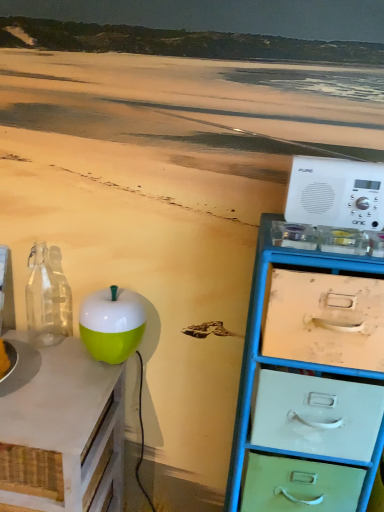
The height and width of the screenshot is (512, 384). What do you see at coordinates (310, 373) in the screenshot? I see `metallic blue chest of drawers at right` at bounding box center [310, 373].

This screenshot has height=512, width=384. What do you see at coordinates (42, 300) in the screenshot?
I see `transparent glass bottle at left` at bounding box center [42, 300].

In order to click on transparent glass bottle at left in this screenshot , I will do `click(42, 300)`.

Image resolution: width=384 pixels, height=512 pixels. Find the location of `metallic blue chest of drawers at right`. metallic blue chest of drawers at right is located at coordinates (310, 373).

Is green glossy apple at center-left taller than transparent glass bottle at left?

Incorrect, the height of green glossy apple at center-left is not larger of that of transparent glass bottle at left.

At what (x,y) coordinates should I click in order to perform the action: click on bottle that is behind the green glossy apple at center-left. Please return your answer as a coordinate pair (x, y). Image resolution: width=384 pixels, height=512 pixels. Looking at the image, I should click on (42, 300).

Is point (88, 322) closer or farther from the camera than point (36, 266)?

Point (88, 322).

Could you tell me if green glossy apple at center-left is facing transparent glass bottle at left?

No, green glossy apple at center-left is not turned towards transparent glass bottle at left.

Who is taller, green glossy apple at center-left or white plastic radio at right?

Standing taller between the two is green glossy apple at center-left.

Does green glossy apple at center-left have a smaller size compared to white plastic radio at right?

No.

From a real-world perspective, which is physically below, green glossy apple at center-left or white plastic radio at right?

In real-world perspective, green glossy apple at center-left is lower.

Between transparent glass bottle at left and metallic blue chest of drawers at right, which one has less height?

transparent glass bottle at left.

Between point (34, 319) and point (331, 442), which one is positioned behind?

The point (34, 319) is behind.

Which is correct: transparent glass bottle at left is inside metallic blue chest of drawers at right, or outside of it?

transparent glass bottle at left is spatially situated outside metallic blue chest of drawers at right.

Would you say transparent glass bottle at left is to the left or to the right of metallic blue chest of drawers at right in the picture?

transparent glass bottle at left is positioned on metallic blue chest of drawers at right's left side.

At what (x,y) coordinates should I click in order to perform the action: click on table that is under the white plastic radio at right (from a real-world perspective). Please return your answer as a coordinate pair (x, y). This screenshot has height=512, width=384. Looking at the image, I should click on (61, 430).

Considering the positions of points (346, 192) and (32, 441), is point (346, 192) farther from camera compared to point (32, 441)?

Yes, it is.

From a real-world perspective, is white plastic radio at right below green matte apple at left?

No, from a real-world perspective, white plastic radio at right is not beneath green matte apple at left.

From a real-world perspective, between green matte apple at left and white plastic radio at right, who is vertically higher?

From a 3D spatial view, white plastic radio at right is above.

Which point is more forward, (30, 496) or (310, 158)?

The point (310, 158) is closer.

Locate an element on the screen. The height and width of the screenshot is (512, 384). table that is under the white plastic radio at right (from a real-world perspective) is located at coordinates 61,430.

From the image's perspective, is transparent glass bottle at left beneath green matte apple at left?

No, from the image's perspective, transparent glass bottle at left is not beneath green matte apple at left.

From their relative heights in the image, would you say transparent glass bottle at left is taller or shorter than green matte apple at left?

Considering their sizes, transparent glass bottle at left has less height than green matte apple at left.

Is transparent glass bottle at left facing away from green matte apple at left?

No, green matte apple at left is not at the back of transparent glass bottle at left.

Is point (29, 451) closer to viewer compared to point (120, 291)?

Yes, it is.

Considering the relative positions of green matte apple at left and green glossy apple at center-left in the image provided, is green matte apple at left behind green glossy apple at center-left?

No, it is in front of green glossy apple at center-left.

Which object is positioned more to the left, green matte apple at left or green glossy apple at center-left?

Positioned to the left is green matte apple at left.

What are the coordinates of `bottle on the left of green glossy apple at center-left` in the screenshot? It's located at (42, 300).

This screenshot has width=384, height=512. I want to click on appliance in front of the green glossy apple at center-left, so click(x=336, y=193).

When comparing their distances from green matte apple at left, does green glossy apple at center-left or white plastic radio at right seem closer?

green glossy apple at center-left lies closer to green matte apple at left than the other object.

Considering their positions, is green glossy apple at center-left positioned further to metallic blue chest of drawers at right than green matte apple at left?

Based on the image, green matte apple at left appears to be further to metallic blue chest of drawers at right.

Which object lies further to the anchor point white plastic radio at right, metallic blue chest of drawers at right or green glossy apple at center-left?

Based on the image, green glossy apple at center-left appears to be further to white plastic radio at right.

From the image, which object appears to be nearer to metallic blue chest of drawers at right, green matte apple at left or green glossy apple at center-left?

green glossy apple at center-left is closer to metallic blue chest of drawers at right.

From the image, which object appears to be nearer to green glossy apple at center-left, metallic blue chest of drawers at right or white plastic radio at right?

The object closer to green glossy apple at center-left is metallic blue chest of drawers at right.

Based on their spatial positions, is transparent glass bottle at left or green matte apple at left closer to green glossy apple at center-left?

green matte apple at left lies closer to green glossy apple at center-left than the other object.

Based on the photo, looking at the image, which one is located further to green glossy apple at center-left, white plastic radio at right or green matte apple at left?

white plastic radio at right is further to green glossy apple at center-left.

When comparing their distances from transparent glass bottle at left, does green matte apple at left or white plastic radio at right seem further?

white plastic radio at right lies further to transparent glass bottle at left than the other object.

This screenshot has width=384, height=512. Find the location of `teal that lies between transparent glass bottle at left and green matte apple at left from top to bottom`. teal that lies between transparent glass bottle at left and green matte apple at left from top to bottom is located at coordinates (112, 324).

At what (x,y) coordinates should I click in order to perform the action: click on teal between white plastic radio at right and green matte apple at left in the vertical direction. Please return your answer as a coordinate pair (x, y). The width and height of the screenshot is (384, 512). Looking at the image, I should click on (112, 324).

You are a GUI agent. You are given a task and a screenshot of the screen. Output one action in this format:
    pyautogui.click(x=<x>, y=<y>)
    Task: Click on the teal located between transparent glass bottle at left and white plastic radio at right in the left-right direction
    This screenshot has width=384, height=512.
    Given the screenshot: What is the action you would take?
    pyautogui.click(x=112, y=324)

Image resolution: width=384 pixels, height=512 pixels. Find the location of `bottle located between green matte apple at left and white plastic radio at right in the left-right direction`. bottle located between green matte apple at left and white plastic radio at right in the left-right direction is located at coordinates (42, 300).